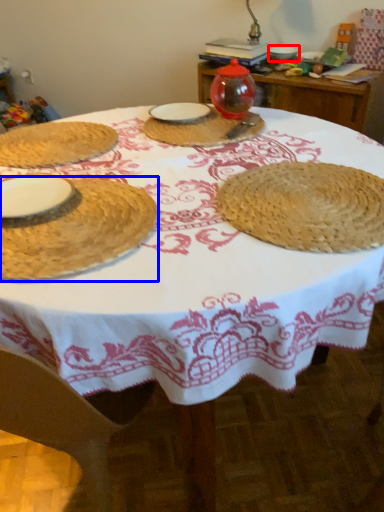
Question: Which of the following is the farthest to the observer, tableware (highlighted by a red box) or tableware (highlighted by a blue box)?

Choices:
 (A) tableware
 (B) tableware

Answer: (A)